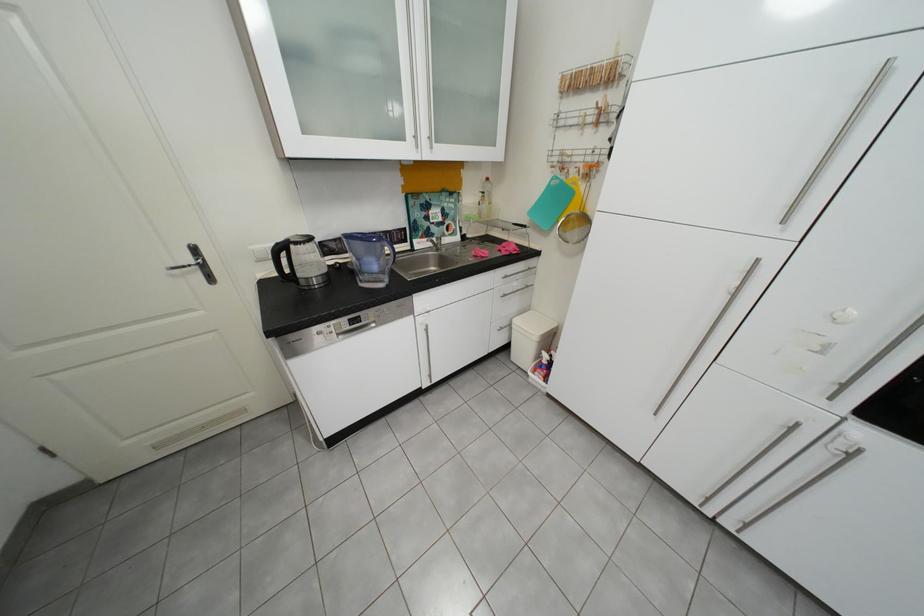
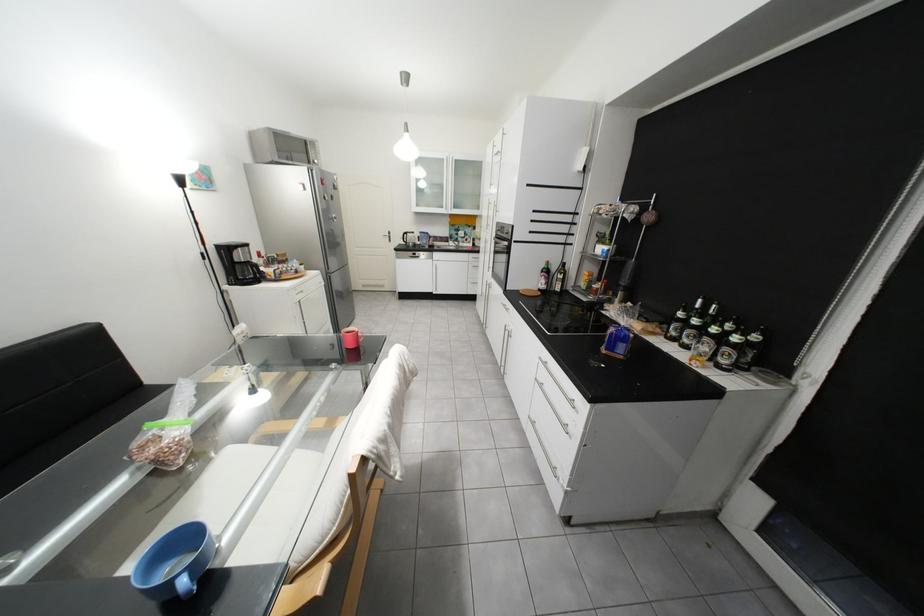
Locate, in the second image, the point that corresponds to (x=207, y=252) in the first image.

(402, 233)